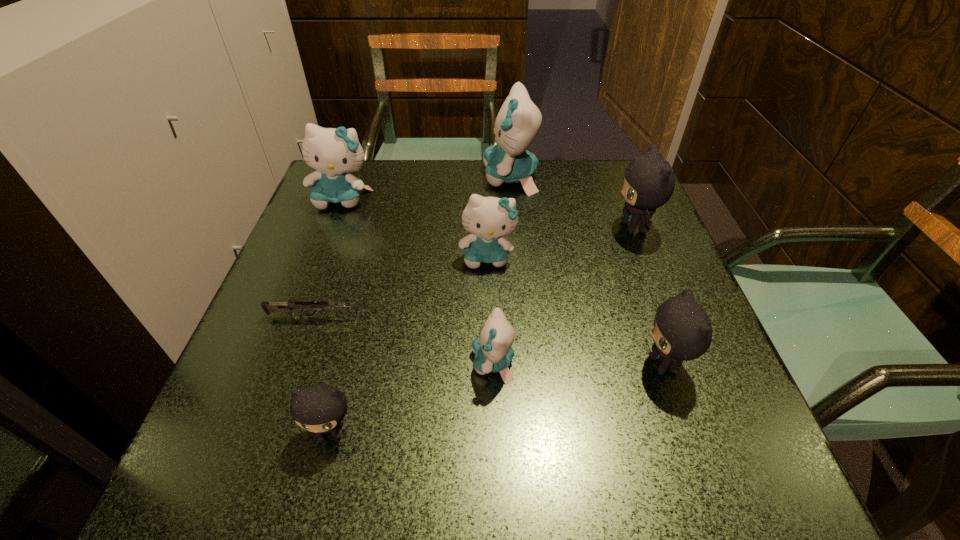
The height and width of the screenshot is (540, 960). Find the location of `the tallest kitten`. the tallest kitten is located at coordinates (517, 124).

At what (x,y) coordinates should I click in order to perform the action: click on the biggest blue kitten. Please return your answer as a coordinate pair (x, y). This screenshot has height=540, width=960. Looking at the image, I should click on (517, 124).

Where is `the third smallest blue kitten`? the third smallest blue kitten is located at coordinates (333, 152).

Identify the location of the biggest gray kitten. Image resolution: width=960 pixels, height=540 pixels. pos(649,181).

Identify the location of the second nearest blue kitten. This screenshot has height=540, width=960. (488, 219).

This screenshot has height=540, width=960. What are the coordinates of `the second biggest gray kitten` in the screenshot? It's located at (682, 330).

At what (x,y) coordinates should I click in order to perform the action: click on the smallest blue kitten. Please return your answer as a coordinate pair (x, y). The image size is (960, 540). Looking at the image, I should click on (493, 353).

Locate an element on the screen. The width and height of the screenshot is (960, 540). the leftmost gray kitten is located at coordinates [x=320, y=408].

Identify the location of the nearest kitten. (320, 408).

Find the location of a particular element. Image resolution: width=960 pixels, height=540 pixels. gun is located at coordinates (287, 308).